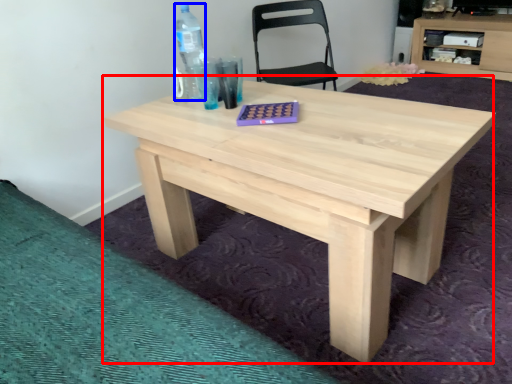
Question: Which object appears farthest to the camera in this image, table (highlighted by a red box) or bottle (highlighted by a blue box)?

Choices:
 (A) table
 (B) bottle

Answer: (B)